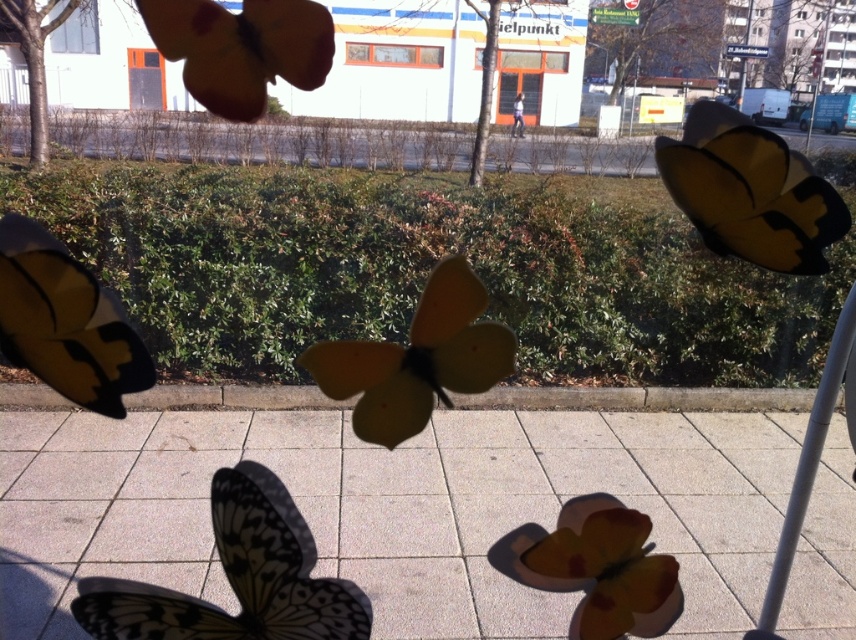
You are standing outside looking at the butterflies through the window. Which butterfly, the yellow matte butterfly at right or the matte yellow butterfly at left, is closer to you?

The yellow matte butterfly at right is closer to you because the matte yellow butterfly at left is behind it.

You are standing outside the window and want to place a new butterfly decoration between the matte yellow butterfly at upper left and the gray metallic pole at right. Based on their positions, which object should the new butterfly be closer to?

The matte yellow butterfly at upper left is to the left of the gray metallic pole at right, so the new butterfly should be placed closer to the matte yellow butterfly at upper left to maintain the leftward position between them.